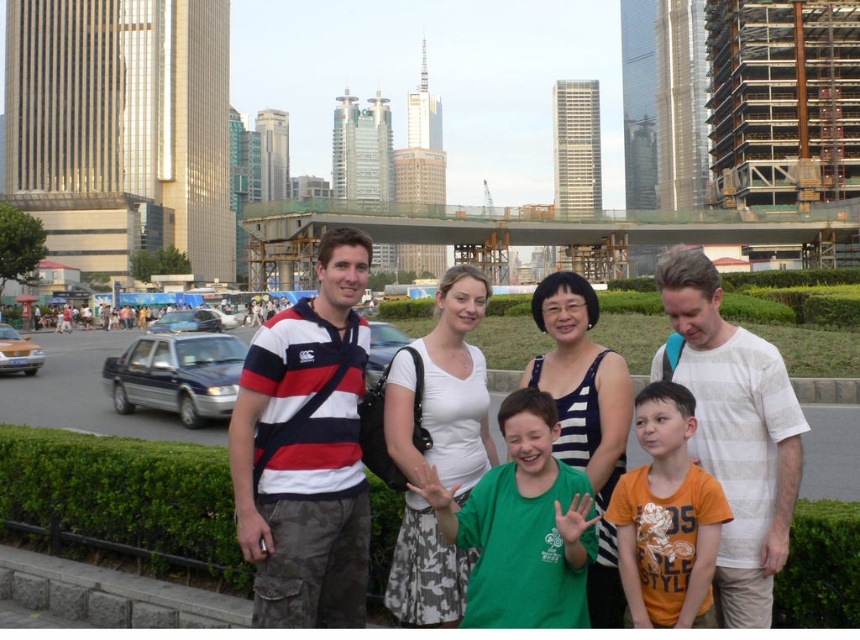
Is striped cotton shirt at center taller than orange cotton shirt at center?

Yes, striped cotton shirt at center is taller than orange cotton shirt at center.

Is point (249, 410) positioned in front of point (639, 493)?

No, (249, 410) is behind (639, 493).

What are the coordinates of `striped cotton shirt at center` in the screenshot? It's located at (306, 451).

Between green matte shirt at center and shiny silver sedan at left, which one has more height?

green matte shirt at center is taller.

Who is higher up, green matte shirt at center or shiny silver sedan at left?

shiny silver sedan at left is higher up.

Between point (581, 531) and point (191, 310), which one is positioned in front?

Point (581, 531) is in front.

At what (x,y) coordinates should I click in order to perform the action: click on green matte shirt at center. Please return your answer as a coordinate pair (x, y). This screenshot has height=640, width=860. Looking at the image, I should click on (523, 525).

Is orange cotton shirt at center to the left of metallic blue sedan at left from the viewer's perspective?

Incorrect, orange cotton shirt at center is not on the left side of metallic blue sedan at left.

Which is more to the right, orange cotton shirt at center or metallic blue sedan at left?

From the viewer's perspective, orange cotton shirt at center appears more on the right side.

Find the location of `orange cotton shirt at center`. orange cotton shirt at center is located at coordinates (666, 516).